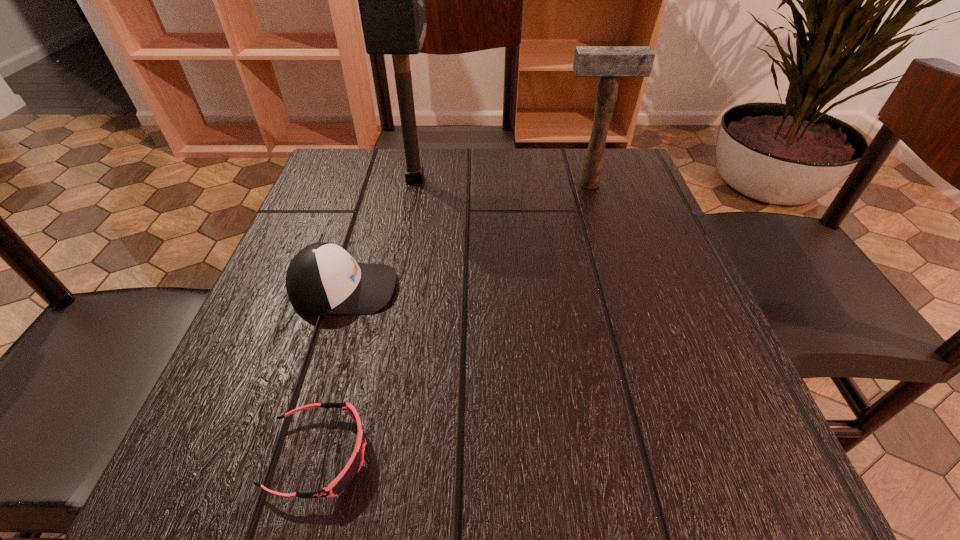
Identify the location of empty location between the cap and the tallest object. (379, 234).

Find the location of a particular element. free space between the rightmost object and the second nearest object is located at coordinates (467, 236).

I want to click on free space between the cap and the rightmost object, so click(x=467, y=236).

Locate an element on the screen. The width and height of the screenshot is (960, 540). vacant space in between the rightmost object and the second nearest object is located at coordinates (467, 236).

The height and width of the screenshot is (540, 960). Find the location of `vacant area between the cap and the goggles`. vacant area between the cap and the goggles is located at coordinates (331, 372).

Identify which object is located as the nearest to the right mallet. Please provide its 2D coordinates. Your answer should be formatted as a tuple, i.e. [(x, y)], where the tuple contains the x and y coordinates of a point satisfying the conditions above.

[(391, 0)]

Choose which object is the third nearest neighbor to the nearest object. Please provide its 2D coordinates. Your answer should be formatted as a tuple, i.e. [(x, y)], where the tuple contains the x and y coordinates of a point satisfying the conditions above.

[(610, 63)]

The height and width of the screenshot is (540, 960). In order to click on vacant region that satisfies the following two spatial constraints: 1. on the front side of the taller mallet; 2. on the front-facing side of the nearest object in this screenshot , I will do `click(363, 455)`.